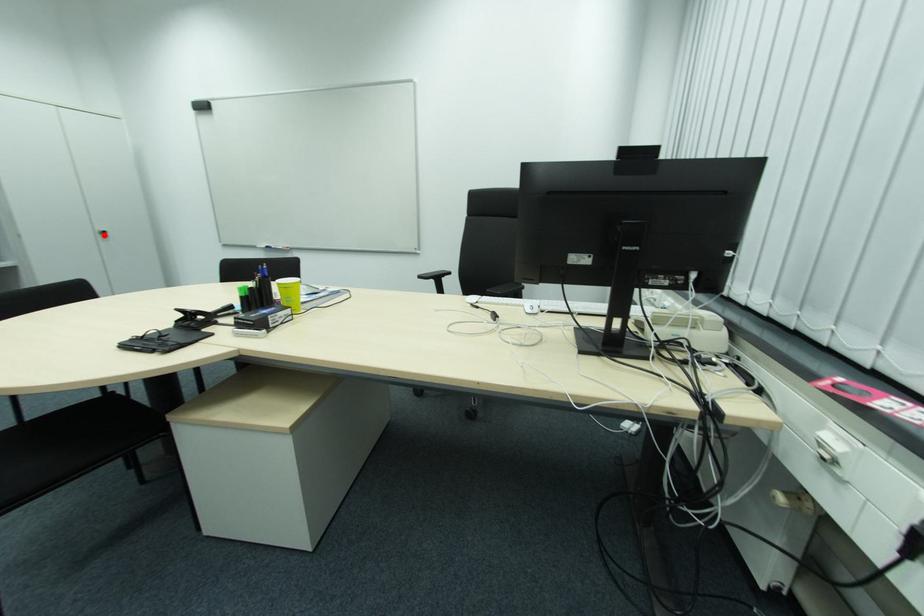
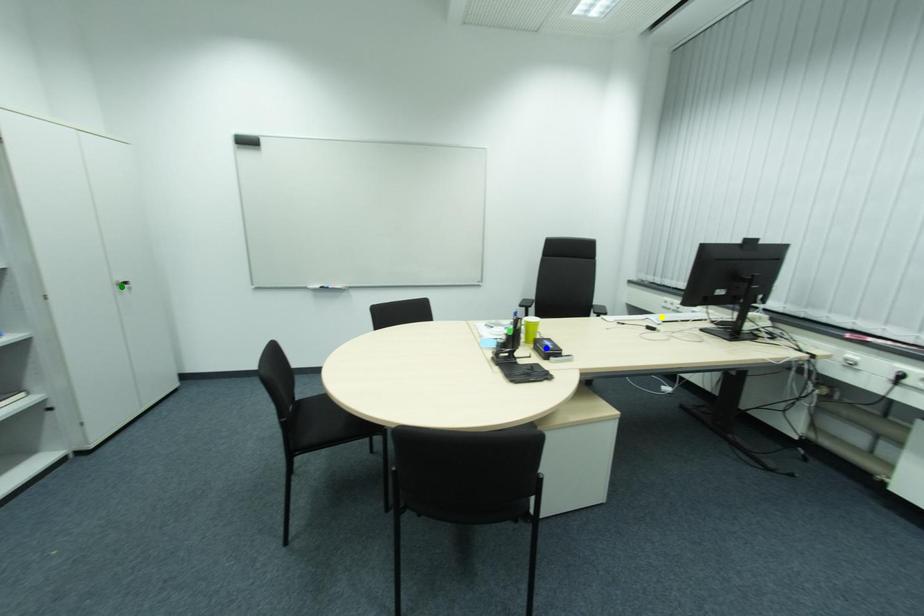
Question: I am providing you with two images of the same scene from different viewpoints. A red point is marked on the first image. You are given multiple points on the second image. Which spot in image 2 lines up with the point in image 1?

Choices:
 (A) green point
 (B) blue point
 (C) yellow point

Answer: (A)